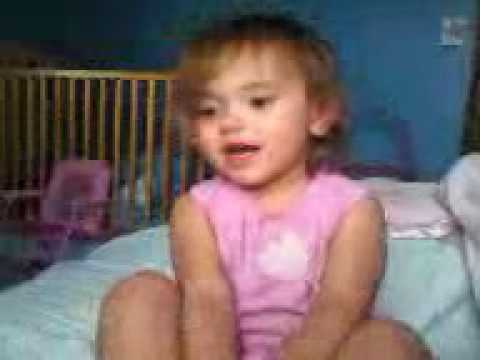
Image resolution: width=480 pixels, height=360 pixels. I want to click on chair, so click(x=72, y=190).